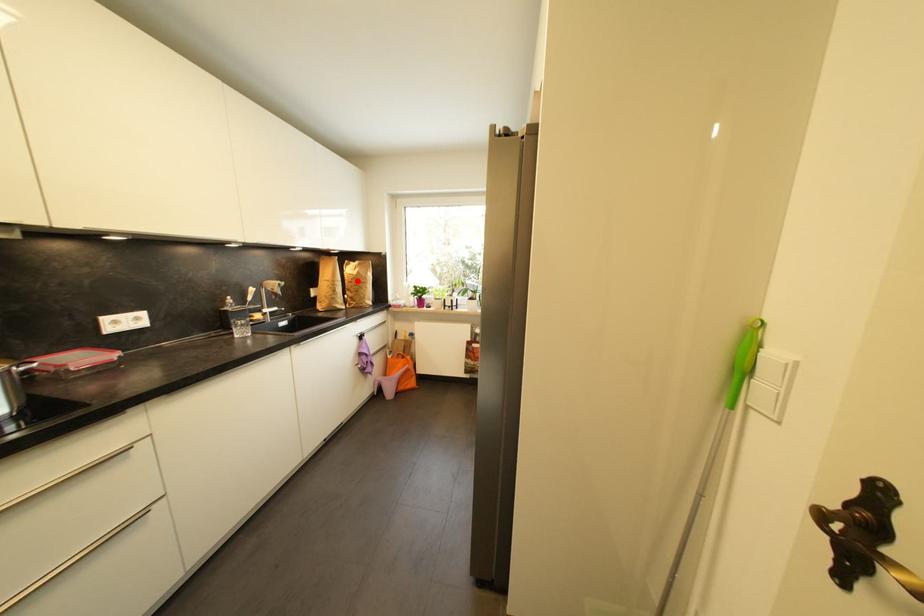
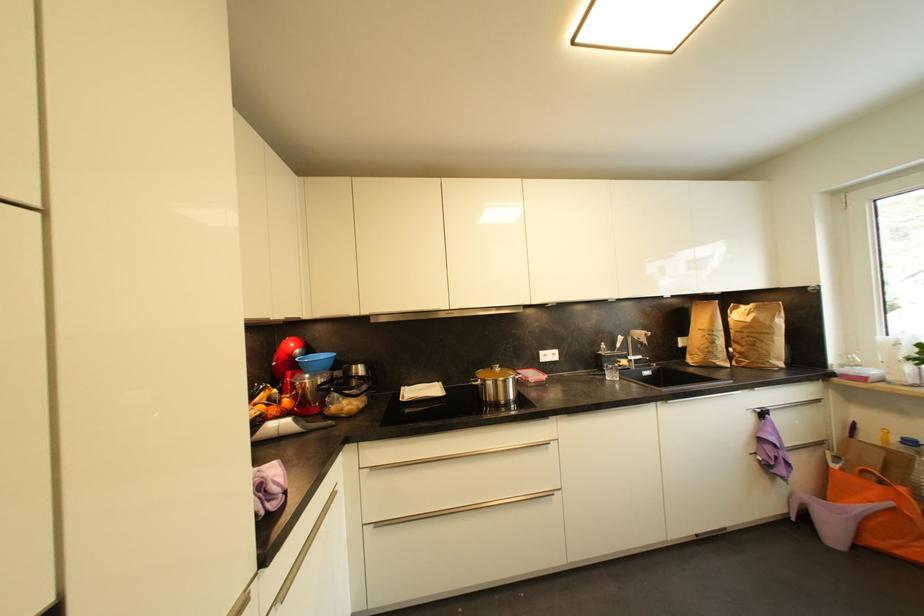
Find the pixel in the second image that matches the highlighted location in the first image.

(748, 330)